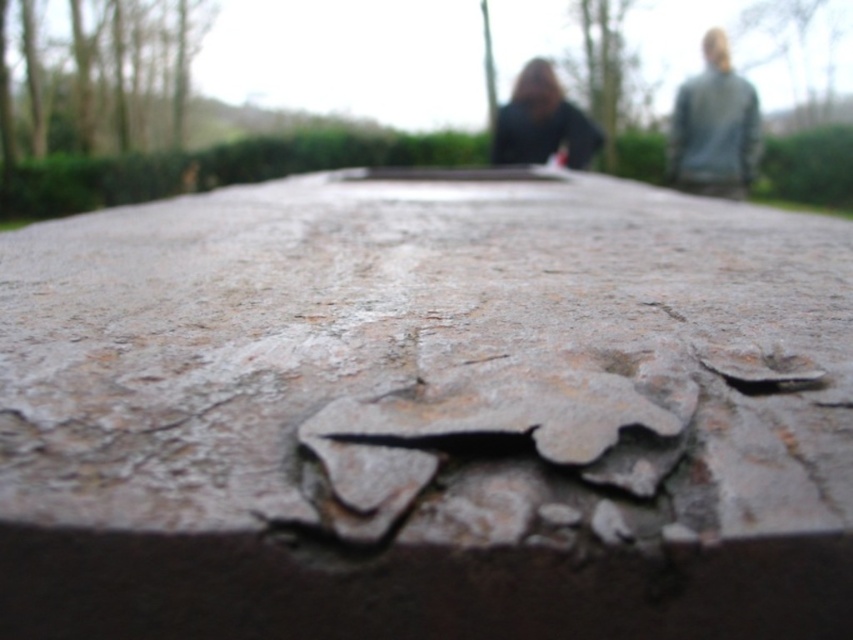
Between point (467, 328) and point (532, 81), which one is positioned in front?

Point (467, 328)

Is point (215, 390) farther from viewer compared to point (547, 65)?

No, (215, 390) is closer to viewer.

The image size is (853, 640). In order to click on rusty metal concrete at center in this screenshot , I will do `click(427, 412)`.

Which is in front, point (641, 212) or point (750, 140)?

Point (641, 212) is in front.

Is rusty metal concrete at center bigger than gray matte jacket at upper right?

Yes.

Between point (672, 417) and point (701, 154), which one is positioned in front?

Positioned in front is point (672, 417).

What are the coordinates of `rusty metal concrete at center` in the screenshot? It's located at (427, 412).

Between blurred hair at upper center and matte black hair at upper center, which one is positioned lower?

Positioned lower is blurred hair at upper center.

The width and height of the screenshot is (853, 640). What do you see at coordinates (714, 128) in the screenshot?
I see `blurred hair at upper center` at bounding box center [714, 128].

Image resolution: width=853 pixels, height=640 pixels. Find the location of `blurred hair at upper center`. blurred hair at upper center is located at coordinates (714, 128).